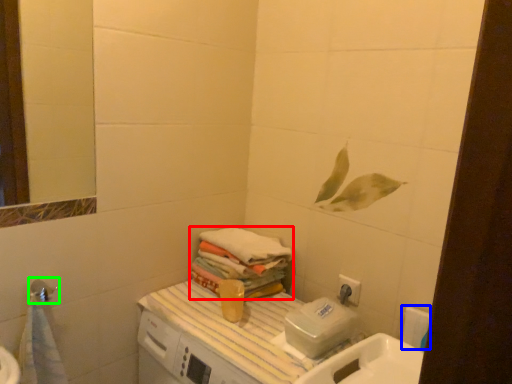
Question: Estimate the real-world distances between objects in this image. Which object is closer to bath towel (highlighted by a red box), toilet paper (highlighted by a blue box) or shower (highlighted by a green box)?

Choices:
 (A) toilet paper
 (B) shower

Answer: (A)